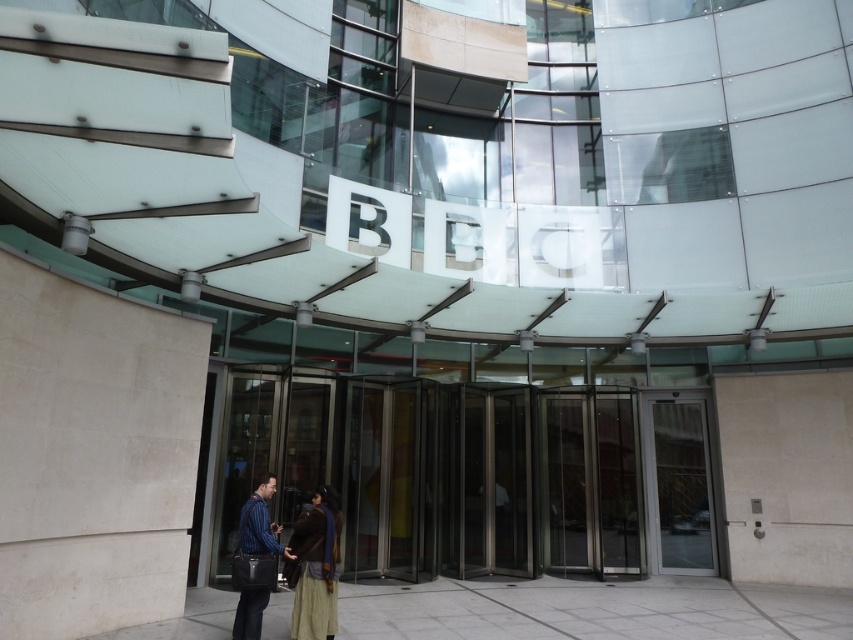
From the picture: Does brown textured coat at center come in front of striped fabric shirt at center?

That is True.

Consider the image. Who is positioned more to the right, brown textured coat at center or striped fabric shirt at center?

brown textured coat at center is more to the right.

Which is behind, point (294, 525) or point (257, 536)?

Point (294, 525)

The width and height of the screenshot is (853, 640). Identify the location of brown textured coat at center. (315, 566).

Can you confirm if transparent glass door at center is shorter than striped fabric shirt at center?

Incorrect, transparent glass door at center's height does not fall short of striped fabric shirt at center's.

Which is more to the left, transparent glass door at center or striped fabric shirt at center?

From the viewer's perspective, striped fabric shirt at center appears more on the left side.

Who is more distant from viewer, (653, 426) or (258, 525)?

The point (653, 426) is more distant.

At what (x,y) coordinates should I click in order to perform the action: click on transparent glass door at center. Please return your answer as a coordinate pair (x, y). The height and width of the screenshot is (640, 853). Looking at the image, I should click on (682, 484).

Is transparent glass door at center smaller than brown textured coat at center?

Actually, transparent glass door at center might be larger than brown textured coat at center.

Where is `transparent glass door at center`? transparent glass door at center is located at coordinates (682, 484).

The height and width of the screenshot is (640, 853). Find the location of `transparent glass door at center`. transparent glass door at center is located at coordinates (682, 484).